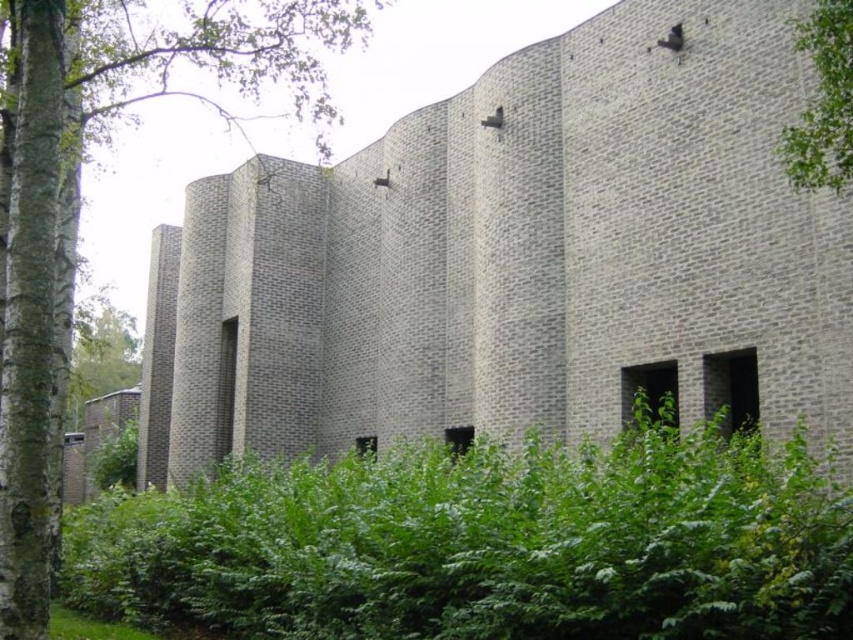
Question: Is green leafy shrub at center below green leafy grass at lower left?

Choices:
 (A) no
 (B) yes

Answer: (A)

Question: Is green leafy tree at left below green leafy grass at lower left?

Choices:
 (A) no
 (B) yes

Answer: (A)

Question: Does green leafy shrub at center appear under green leafy tree at left?

Choices:
 (A) no
 (B) yes

Answer: (B)

Question: Which point is closer to the camera taking this photo?

Choices:
 (A) (100, 22)
 (B) (97, 624)
 (C) (267, 524)
 (D) (836, 112)

Answer: (C)

Question: Which point is farther to the camera?

Choices:
 (A) green leafy tree at upper right
 (B) green leafy tree at left
 (C) green leafy shrub at center

Answer: (A)

Question: Estimate the real-world distances between objects in this image. Which object is farther from the green leafy tree at left?

Choices:
 (A) green leafy shrub at center
 (B) green leafy grass at lower left
 (C) green leafy tree at upper right

Answer: (C)